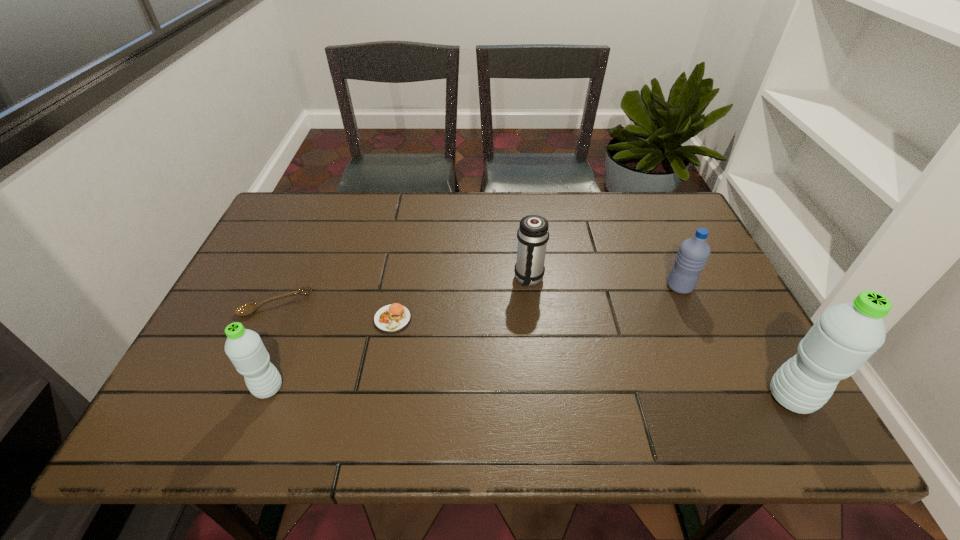
In the image, there is a desktop. At what (x,y) coordinates should I click in order to perform the action: click on free space at the near edge. Please return your answer as a coordinate pair (x, y). The image size is (960, 540). Looking at the image, I should click on (597, 370).

Where is `vacant space at the left edge of the desktop`? vacant space at the left edge of the desktop is located at coordinates (225, 326).

At what (x,y) coordinates should I click in order to perform the action: click on vacant area at the right edge of the desktop. Please return your answer as a coordinate pair (x, y). The image size is (960, 540). Looking at the image, I should click on (x=698, y=294).

This screenshot has height=540, width=960. In the image, there is a desktop. Identify the location of vacant space at the far left corner. (282, 219).

Locate an element on the screen. The image size is (960, 540). empty space that is in between the rightmost object and the farthest water bottle is located at coordinates (735, 342).

Find the location of a particular element. The image size is (960, 540). unoccupied position between the leftmost water bottle and the farthest water bottle is located at coordinates (474, 338).

The image size is (960, 540). Find the location of `free area in between the leftmost water bottle and the thermos bottle`. free area in between the leftmost water bottle and the thermos bottle is located at coordinates (398, 334).

The width and height of the screenshot is (960, 540). In order to click on unoccupied area between the leftmost water bottle and the thermos bottle in this screenshot , I will do `click(398, 334)`.

Find the location of a particular element. blank region between the second shortest object and the second water bottle from left to right is located at coordinates (536, 303).

What are the coordinates of `vacant region between the third object from right to left and the patty` in the screenshot? It's located at (461, 299).